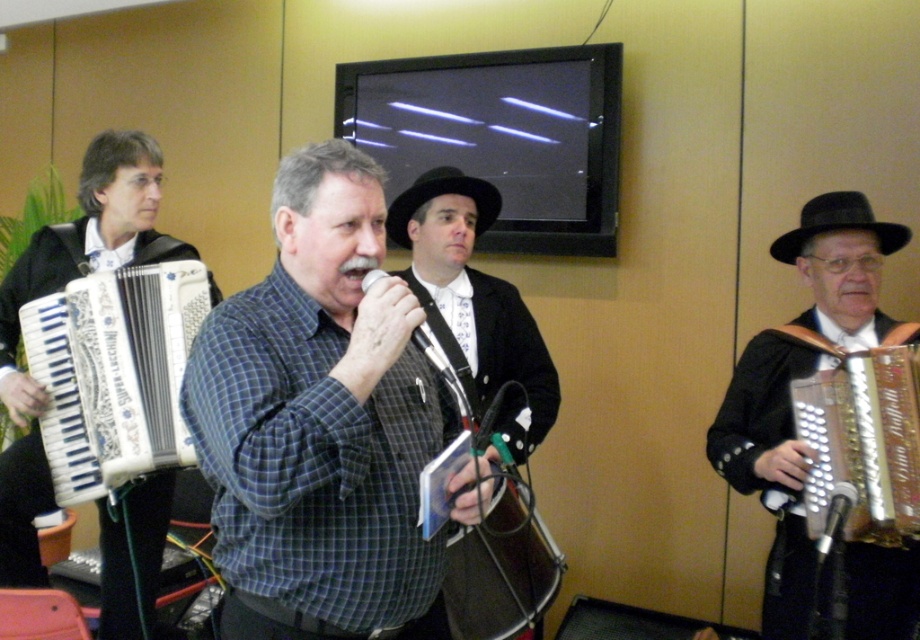
Question: Which object appears closest to the camera in this image?

Choices:
 (A) shiny gold accordion at right
 (B) blue plaid shirt at center

Answer: (B)

Question: Does blue plaid shirt at center come behind white plastic accordion at left?

Choices:
 (A) yes
 (B) no

Answer: (B)

Question: Which point is farther to the camera?

Choices:
 (A) (805, 244)
 (B) (222, 625)

Answer: (A)

Question: Which of the following is the farthest from the observer?

Choices:
 (A) white matte accordion at left
 (B) shiny gold accordion at right
 (C) blue plaid shirt at center

Answer: (A)

Question: Is blue plaid shirt at center below shiny gold accordion at right?

Choices:
 (A) no
 (B) yes

Answer: (A)

Question: Is shiny gold accordion at right thinner than white plastic accordion at left?

Choices:
 (A) no
 (B) yes

Answer: (A)